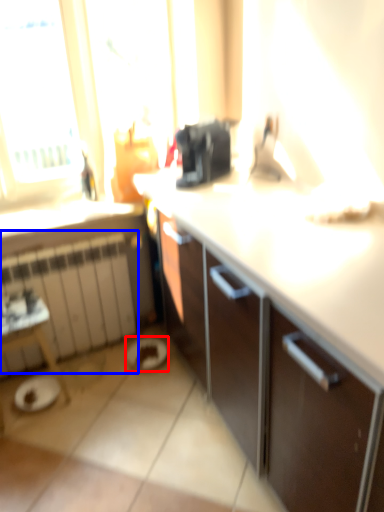
Question: Which object is closer to the camera taking this photo, manhole (highlighted by a red box) or radiator (highlighted by a blue box)?

Choices:
 (A) manhole
 (B) radiator

Answer: (B)